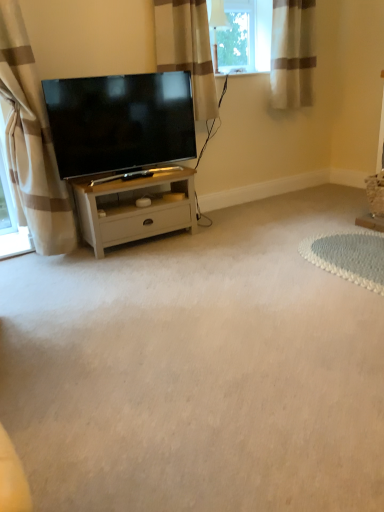
Find the location of a particular element. Image resolution: width=384 pixels, height=512 pixels. vacant area that is in front of white wood cabinet at center is located at coordinates (133, 270).